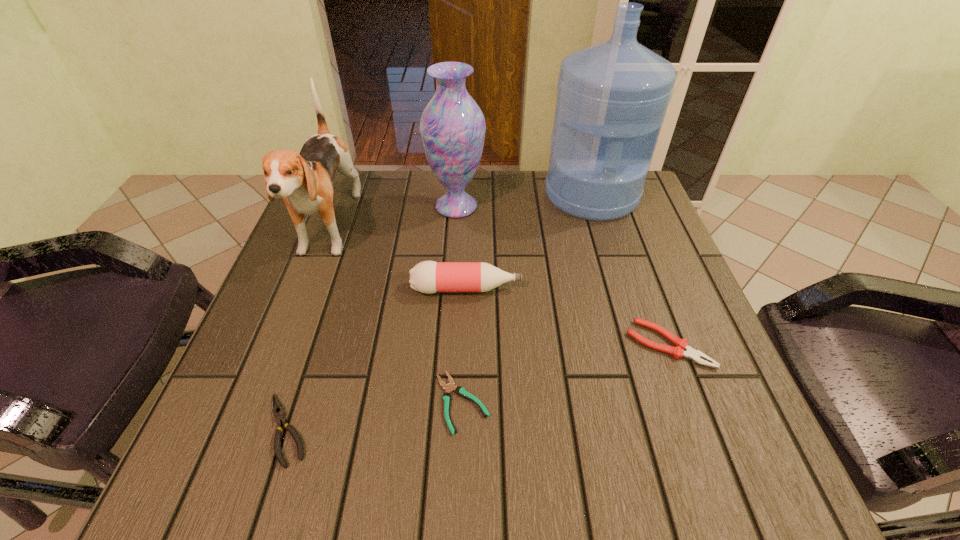
Identify the location of puppy that is at the left edge. (304, 180).

I want to click on pliers positioned at the left edge, so coord(278,411).

Where is `water jug present at the right edge`? The height and width of the screenshot is (540, 960). water jug present at the right edge is located at coordinates (612, 97).

Where is `pliers present at the right edge`? The image size is (960, 540). pliers present at the right edge is located at coordinates (696, 356).

Locate an element on the screen. The image size is (960, 540). object positioned at the far left corner is located at coordinates pyautogui.click(x=304, y=180).

Find the location of a particular element. object at the near left corner is located at coordinates coord(278,411).

The image size is (960, 540). Find the location of `object that is at the far right corner`. object that is at the far right corner is located at coordinates (612, 97).

This screenshot has height=540, width=960. Find the location of `free space at the far edge`. free space at the far edge is located at coordinates (525, 219).

Where is `vacant space at the left edge of the desktop`? The width and height of the screenshot is (960, 540). vacant space at the left edge of the desktop is located at coordinates (268, 316).

In the image, there is a desktop. Where is `blank space at the right edge`? This screenshot has width=960, height=540. blank space at the right edge is located at coordinates (688, 320).